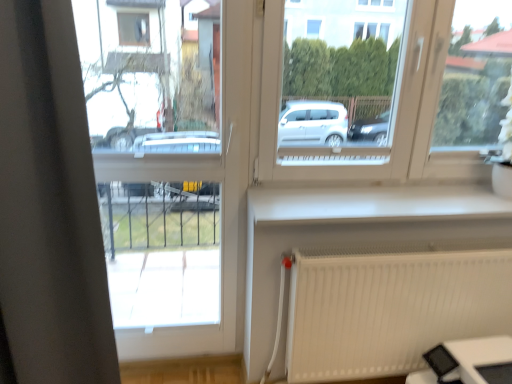
What is the approximate width of white plastic window frame at left?

The width of white plastic window frame at left is 3.19 inches.

I want to click on white smooth window sill at center, so click(373, 204).

Image resolution: width=512 pixels, height=384 pixels. Find the location of `white plastic window at center`. white plastic window at center is located at coordinates (383, 86).

Does white plastic window frame at left turn towards white smooth window sill at center?

No, white plastic window frame at left is not aimed at white smooth window sill at center.

From a real-world perspective, between white plastic window frame at left and white smooth window sill at center, who is vertically lower?

In real-world perspective, white plastic window frame at left is lower.

Is white plastic window frame at left to the left or to the right of white smooth window sill at center in the image?

In the image, white plastic window frame at left appears on the left side of white smooth window sill at center.

Considering the sizes of objects white plastic window frame at left and white smooth window sill at center in the image provided, who is smaller, white plastic window frame at left or white smooth window sill at center?

white smooth window sill at center.

Is white plastic window at center positioned with its back to white plastic window frame at left?

white plastic window at center does not have its back to white plastic window frame at left.

Who is bigger, white plastic window at center or white plastic window frame at left?

white plastic window at center is bigger.

From a real-world perspective, is white plastic window at center below white plastic window frame at left?

No, from a real-world perspective, white plastic window at center is not under white plastic window frame at left.

In the image, there is a white plastic window frame at left. Identify the location of window above it (from the image's perspective). The width and height of the screenshot is (512, 384). (383, 86).

How different are the orientations of white smooth window sill at center and white plastic window at center in degrees?

0.0706 degrees separate the facing orientations of white smooth window sill at center and white plastic window at center.

Which object is further away from the camera, white smooth window sill at center or white plastic window at center?

white smooth window sill at center is further away from the camera.

Is white smooth window sill at center at the left side of white plastic window at center?

Incorrect, white smooth window sill at center is not on the left side of white plastic window at center.

Can you confirm if white smooth window sill at center is shorter than white plastic window at center?

Yes.

How different are the orientations of white smooth window sill at center and white plastic window frame at left in degrees?

white smooth window sill at center and white plastic window frame at left are facing 0.304 degrees away from each other.

Would you say white smooth window sill at center is inside or outside white plastic window frame at left?

white smooth window sill at center is not enclosed by white plastic window frame at left.

In the scene shown: Relative to white plastic window frame at left, is white smooth window sill at center in front or behind?

white smooth window sill at center is behind white plastic window frame at left.

Does white smooth window sill at center have a lesser height compared to white plastic window frame at left?

Correct, white smooth window sill at center is not as tall as white plastic window frame at left.

Considering the sizes of objects white plastic window frame at left and white plastic window at center in the image provided, who is wider, white plastic window frame at left or white plastic window at center?

With larger width is white plastic window at center.

Is white plastic window frame at left far from white plastic window at center?

That's not correct — white plastic window frame at left is a little close to white plastic window at center.

Is white plastic window frame at left bigger or smaller than white plastic window at center?

white plastic window frame at left is smaller than white plastic window at center.

Which of these two, white plastic window at center or white smooth window sill at center, stands shorter?

With less height is white smooth window sill at center.

From a real-world perspective, does white plastic window at center stand above white smooth window sill at center?

Yes, from a real-world perspective, white plastic window at center is above white smooth window sill at center.

Who is smaller, white plastic window at center or white smooth window sill at center?

white smooth window sill at center is smaller.

Can you confirm if white plastic window at center is thinner than white smooth window sill at center?

Correct, the width of white plastic window at center is less than that of white smooth window sill at center.

Identify the location of window sill above the white plastic window frame at left (from a real-world perspective). The image size is (512, 384). (373, 204).

Where is `window frame below the white plastic window at center (from the image's perspective)`? The height and width of the screenshot is (384, 512). window frame below the white plastic window at center (from the image's perspective) is located at coordinates (170, 170).

Based on their spatial positions, is white smooth window sill at center or white plastic window at center further from white plastic window frame at left?

The object further to white plastic window frame at left is white smooth window sill at center.

Based on their spatial positions, is white plastic window frame at left or white plastic window at center closer to white smooth window sill at center?

white plastic window at center is closer to white smooth window sill at center.

Estimate the real-world distances between objects in this image. Which object is further from white plastic window at center, white smooth window sill at center or white plastic window frame at left?

white plastic window frame at left lies further to white plastic window at center than the other object.

Considering their positions, is white plastic window frame at left positioned further to white plastic window at center than white smooth window sill at center?

white plastic window frame at left is positioned further to the anchor white plastic window at center.

When comparing their distances from white smooth window sill at center, does white plastic window at center or white plastic window frame at left seem closer?

white plastic window at center is positioned closer to the anchor white smooth window sill at center.

Based on their spatial positions, is white plastic window at center or white smooth window sill at center closer to white plastic window frame at left?

white plastic window at center.

This screenshot has height=384, width=512. What are the coordinates of `window located between white plastic window frame at left and white smooth window sill at center in the left-right direction` in the screenshot? It's located at (383, 86).